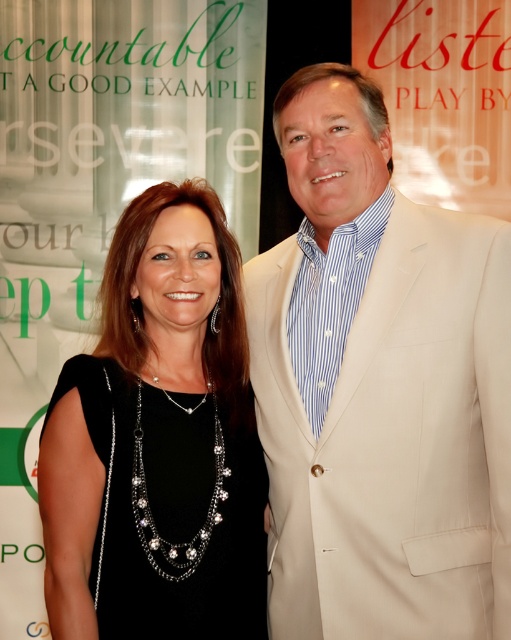
Question: Which point is closer to the camera?

Choices:
 (A) black satin dress at center
 (B) beige textured suit at right

Answer: (B)

Question: Is beige textured suit at right closer to camera compared to black satin dress at center?

Choices:
 (A) yes
 (B) no

Answer: (A)

Question: Among these points, which one is nearest to the camera?

Choices:
 (A) (486, 589)
 (B) (265, 602)

Answer: (A)

Question: Which of the following is the farthest from the observer?

Choices:
 (A) (353, 538)
 (B) (79, 476)

Answer: (A)

Question: Does beige textured suit at right appear on the left side of black satin dress at center?

Choices:
 (A) no
 (B) yes

Answer: (A)

Question: Is beige textured suit at right above black satin dress at center?

Choices:
 (A) yes
 (B) no

Answer: (A)